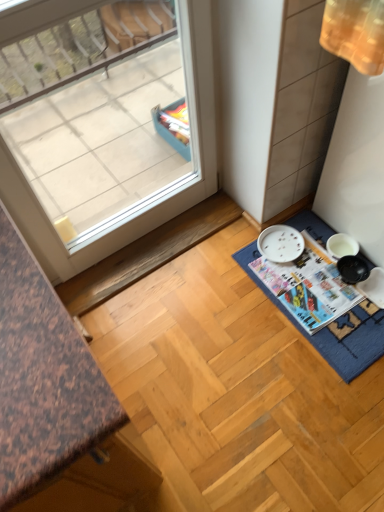
The height and width of the screenshot is (512, 384). Identify the location of vacant space underneath transparent glass window at upper left (from a real-world perspective). (150, 239).